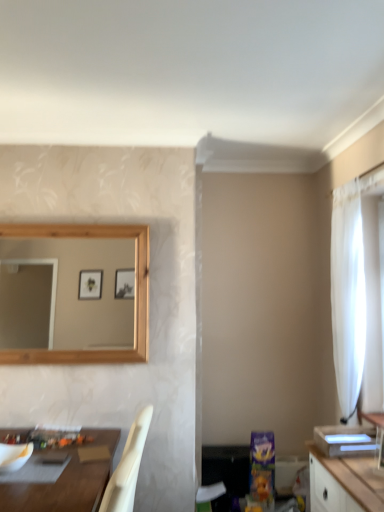
Question: Is white matte mixing bowl at lower left at the right side of brown wooden table at lower left?

Choices:
 (A) yes
 (B) no

Answer: (B)

Question: From the image's perspective, does white matte mixing bowl at lower left appear higher than brown wooden table at lower left?

Choices:
 (A) no
 (B) yes

Answer: (B)

Question: Considering the relative sizes of white matte mixing bowl at lower left and brown wooden table at lower left in the image provided, is white matte mixing bowl at lower left thinner than brown wooden table at lower left?

Choices:
 (A) no
 (B) yes

Answer: (B)

Question: Is white matte mixing bowl at lower left not inside brown wooden table at lower left?

Choices:
 (A) yes
 (B) no

Answer: (A)

Question: Is white matte mixing bowl at lower left positioned before brown wooden table at lower left?

Choices:
 (A) yes
 (B) no

Answer: (B)

Question: From a real-world perspective, is white matte mixing bowl at lower left over brown wooden table at lower left?

Choices:
 (A) yes
 (B) no

Answer: (A)

Question: Is there a large distance between white sheer curtain at right and white glossy vanity at right?

Choices:
 (A) no
 (B) yes

Answer: (A)

Question: Does white sheer curtain at right have a larger size compared to white glossy vanity at right?

Choices:
 (A) yes
 (B) no

Answer: (A)

Question: Can you see white sheer curtain at right touching white glossy vanity at right?

Choices:
 (A) no
 (B) yes

Answer: (A)

Question: Considering the relative positions of white sheer curtain at right and white glossy vanity at right in the image provided, is white sheer curtain at right to the left of white glossy vanity at right from the viewer's perspective?

Choices:
 (A) yes
 (B) no

Answer: (B)

Question: Considering the relative sizes of white sheer curtain at right and white glossy vanity at right in the image provided, is white sheer curtain at right taller than white glossy vanity at right?

Choices:
 (A) no
 (B) yes

Answer: (B)

Question: Does white sheer curtain at right have a greater width compared to white glossy vanity at right?

Choices:
 (A) yes
 (B) no

Answer: (A)

Question: Considering the relative sizes of white glossy vanity at right and brown wooden table at lower left in the image provided, is white glossy vanity at right shorter than brown wooden table at lower left?

Choices:
 (A) yes
 (B) no

Answer: (A)